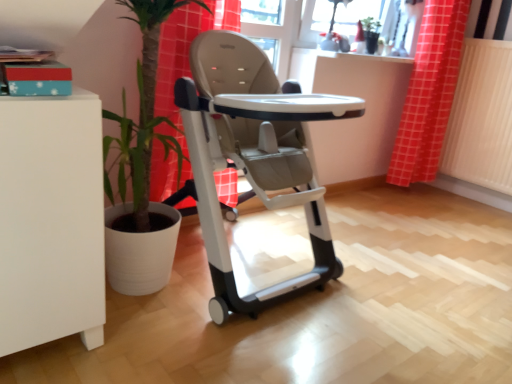
Question: Considering the positions of white textured radiator at right and red checkered curtain at upper right in the image, is white textured radiator at right wider or thinner than red checkered curtain at upper right?

Choices:
 (A) wide
 (B) thin

Answer: (B)

Question: Considering the relative positions of white textured radiator at right and red checkered curtain at upper right in the image provided, is white textured radiator at right to the left or to the right of red checkered curtain at upper right?

Choices:
 (A) left
 (B) right

Answer: (B)

Question: Estimate the real-world distances between objects in this image. Which object is farther from the red checkered curtain at upper right?

Choices:
 (A) white textured radiator at right
 (B) matte glass window screen at upper center
 (C) matte gray high chair at center

Answer: (C)

Question: Based on their relative distances, which object is nearer to the white textured radiator at right?

Choices:
 (A) red checkered curtain at upper right
 (B) matte gray high chair at center
 (C) matte glass window screen at upper center

Answer: (A)